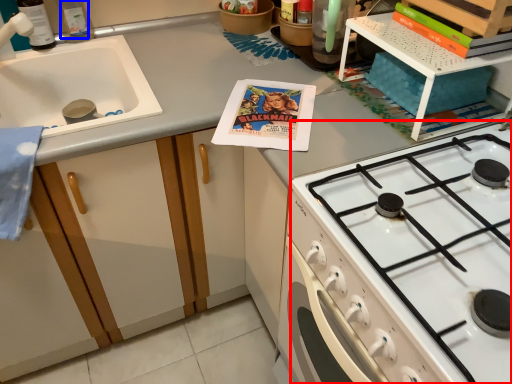
Question: Which object appears closest to the camera in this image, gas stove (highlighted by a red box) or bottle (highlighted by a blue box)?

Choices:
 (A) gas stove
 (B) bottle

Answer: (A)